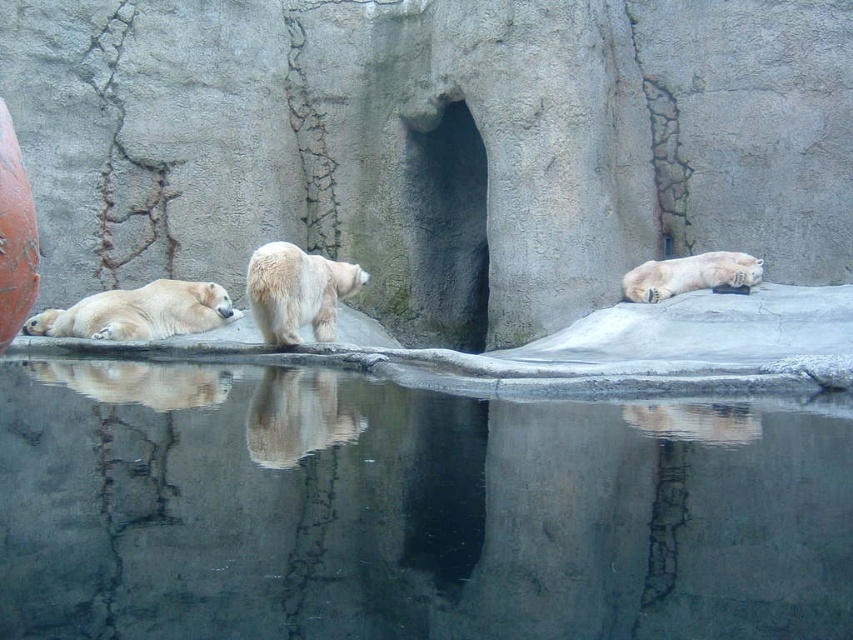
Based on the photo, does white fur bear at left appear on the right side of white fur bear at upper right?

No, white fur bear at left is not to the right of white fur bear at upper right.

Find the location of a particular element. This screenshot has width=853, height=640. white fur bear at left is located at coordinates (138, 312).

Locate an element on the screen. Image resolution: width=853 pixels, height=640 pixels. white fur bear at left is located at coordinates [x=138, y=312].

What do you see at coordinates (434, 145) in the screenshot? Image resolution: width=853 pixels, height=640 pixels. I see `white fur boulder at center` at bounding box center [434, 145].

Can you confirm if white fur boulder at center is smaller than white fluffy bear at center?

No, white fur boulder at center is not smaller than white fluffy bear at center.

Is point (123, 216) positioned after point (323, 326)?

Yes.

The width and height of the screenshot is (853, 640). In order to click on white fur boulder at center in this screenshot , I will do `click(434, 145)`.

Is white fur polar bear at center shorter than white fur bear at upper right?

Indeed, white fur polar bear at center has a lesser height compared to white fur bear at upper right.

Who is more forward, (347, 416) or (672, 278)?

Point (347, 416) is more forward.

The width and height of the screenshot is (853, 640). I want to click on white fur polar bear at center, so click(x=297, y=417).